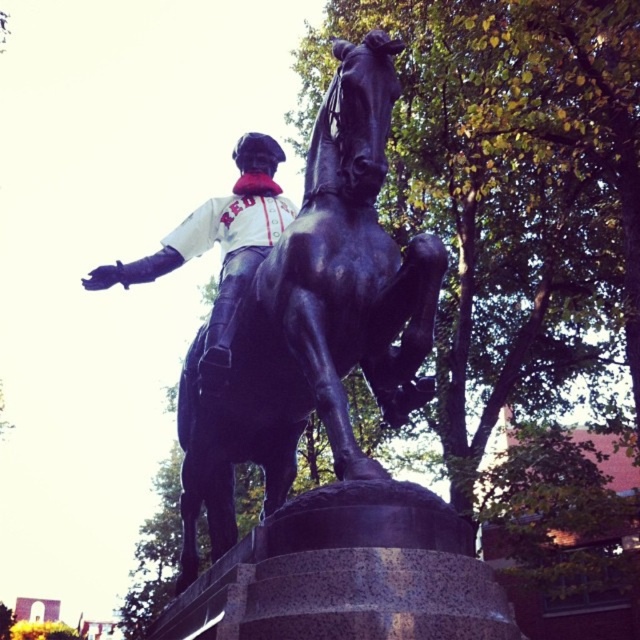
Who is more forward, (339, 397) or (264, 138)?

Point (339, 397) is more forward.

Who is higher up, black polished horse at center or white matte jersey at center?

white matte jersey at center

Is point (250, 451) more distant than point (211, 333)?

That is True.

Image resolution: width=640 pixels, height=640 pixels. In order to click on black polished horse at center in this screenshot , I will do [x=316, y=317].